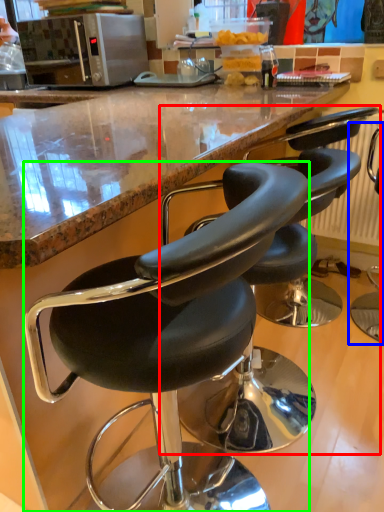
Question: Based on their relative distances, which object is nearer to chair (highlighted by a red box)? Choose from chair (highlighted by a blue box) and chair (highlighted by a green box).

Choices:
 (A) chair
 (B) chair

Answer: (B)